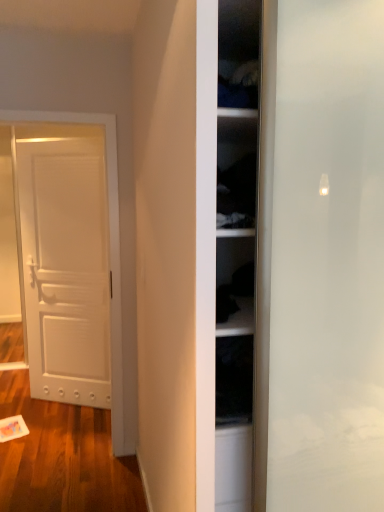
Find the location of a particular element. free spot in front of white matte door at left is located at coordinates (58, 425).